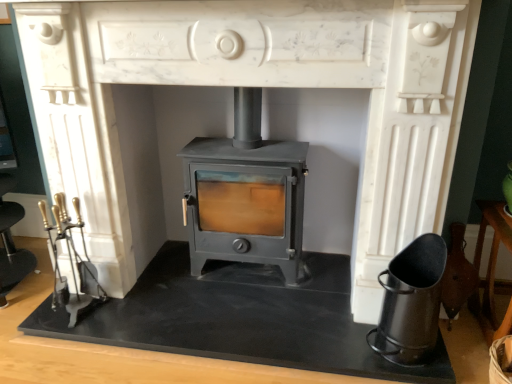
Question: Is matte gray wood burning stove at center wider than black slate at center?

Choices:
 (A) yes
 (B) no

Answer: (B)

Question: Considering the relative positions of matte gray wood burning stove at center and black slate at center in the image provided, is matte gray wood burning stove at center to the left of black slate at center from the viewer's perspective?

Choices:
 (A) yes
 (B) no

Answer: (B)

Question: Can you confirm if matte gray wood burning stove at center is taller than black slate at center?

Choices:
 (A) no
 (B) yes

Answer: (B)

Question: Does matte gray wood burning stove at center have a lesser width compared to black slate at center?

Choices:
 (A) no
 (B) yes

Answer: (B)

Question: From the image's perspective, is matte gray wood burning stove at center beneath black slate at center?

Choices:
 (A) no
 (B) yes

Answer: (A)

Question: From a real-world perspective, relative to matte gray wood burning stove at center, is black matte ash bucket at lower right vertically above or below?

Choices:
 (A) above
 (B) below

Answer: (B)

Question: From the image's perspective, is black matte ash bucket at lower right located above or below matte gray wood burning stove at center?

Choices:
 (A) above
 (B) below

Answer: (B)

Question: In terms of height, does black matte ash bucket at lower right look taller or shorter compared to matte gray wood burning stove at center?

Choices:
 (A) short
 (B) tall

Answer: (A)

Question: Considering the positions of black matte ash bucket at lower right and matte gray wood burning stove at center in the image, is black matte ash bucket at lower right bigger or smaller than matte gray wood burning stove at center?

Choices:
 (A) small
 (B) big

Answer: (A)

Question: From their relative heights in the image, would you say matte gray wood burning stove at center is taller or shorter than black matte ash bucket at lower right?

Choices:
 (A) short
 (B) tall

Answer: (B)

Question: Based on their sizes in the image, would you say matte gray wood burning stove at center is bigger or smaller than black matte ash bucket at lower right?

Choices:
 (A) big
 (B) small

Answer: (A)

Question: Is matte gray wood burning stove at center inside or outside of black matte ash bucket at lower right?

Choices:
 (A) inside
 (B) outside

Answer: (B)

Question: From a real-world perspective, relative to black matte ash bucket at lower right, is matte gray wood burning stove at center vertically above or below?

Choices:
 (A) below
 (B) above

Answer: (B)

Question: Looking at the image, does black slate at center seem bigger or smaller compared to matte gray wood burning stove at center?

Choices:
 (A) big
 (B) small

Answer: (B)

Question: Does point (53, 327) appear closer or farther from the camera than point (252, 127)?

Choices:
 (A) closer
 (B) farther

Answer: (A)